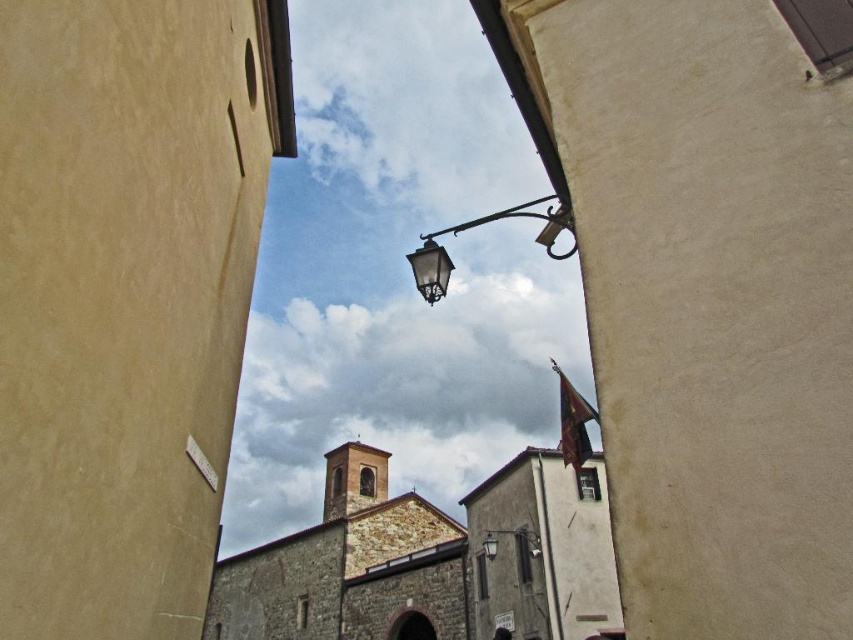
Question: Does black glass lamp at upper center appear on the left side of dark gray stone archway at center?

Choices:
 (A) no
 (B) yes

Answer: (A)

Question: Among these points, which one is farthest from the camera?

Choices:
 (A) (456, 228)
 (B) (383, 525)

Answer: (B)

Question: Which object is closer to the camera taking this photo?

Choices:
 (A) metallic street light at center
 (B) metallic streetlamp at center

Answer: (A)

Question: Which object is closer to the camera taking this photo?

Choices:
 (A) stone church at center
 (B) metallic street light at center
 (C) dark gray stone archway at center
 (D) brown stone church at center

Answer: (A)

Question: Considering the relative positions of metallic street light at center and dark gray stone archway at center in the image provided, where is metallic street light at center located with respect to dark gray stone archway at center?

Choices:
 (A) below
 (B) above

Answer: (B)

Question: Does stone church at center appear on the left side of metallic street light at center?

Choices:
 (A) yes
 (B) no

Answer: (A)